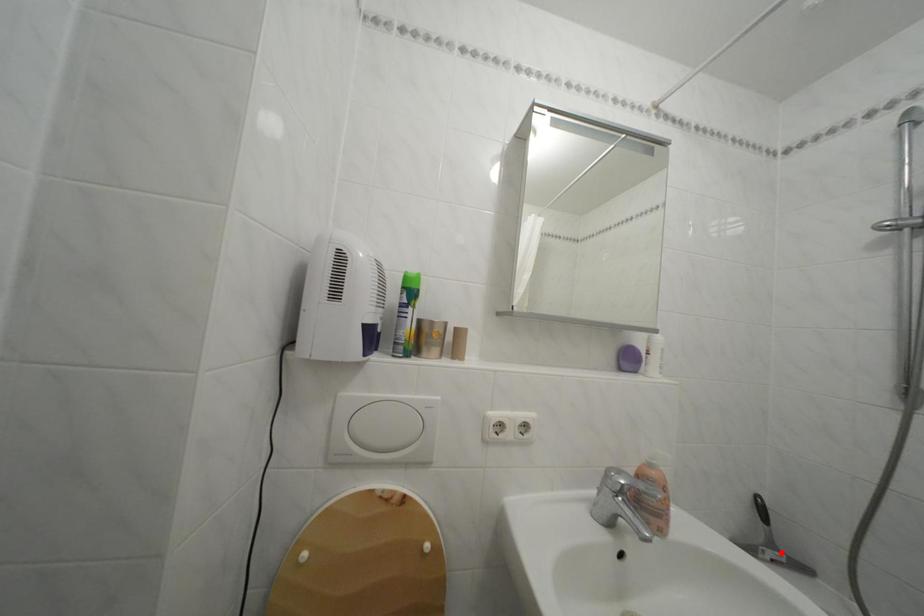
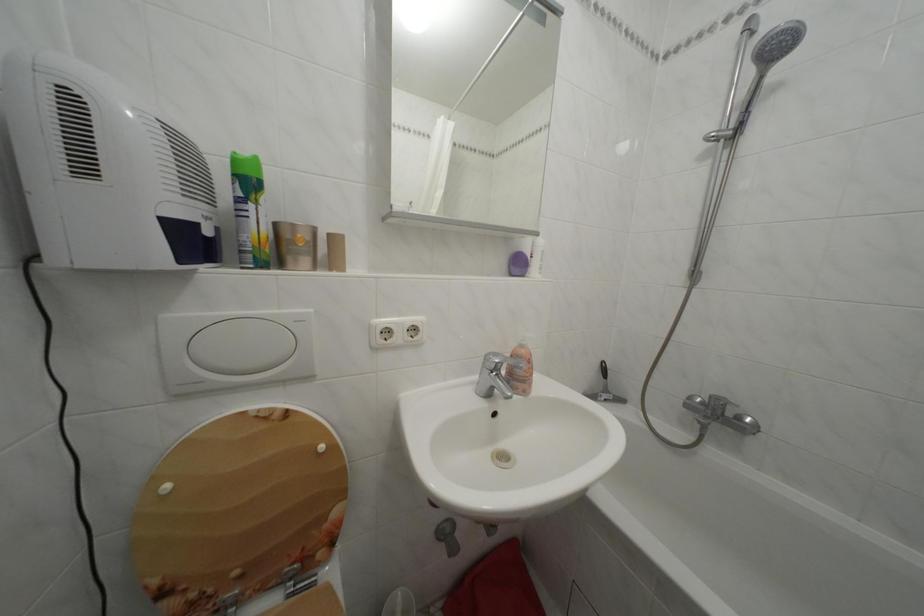
Where in the second image is the point corresponding to the highlighted location from the first image?

(614, 397)